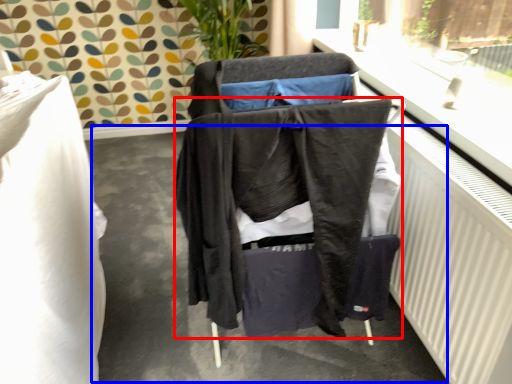
Question: Among these objects, which one is farthest to the camera, jacket (highlighted by a red box) or concrete (highlighted by a blue box)?

Choices:
 (A) jacket
 (B) concrete

Answer: (B)